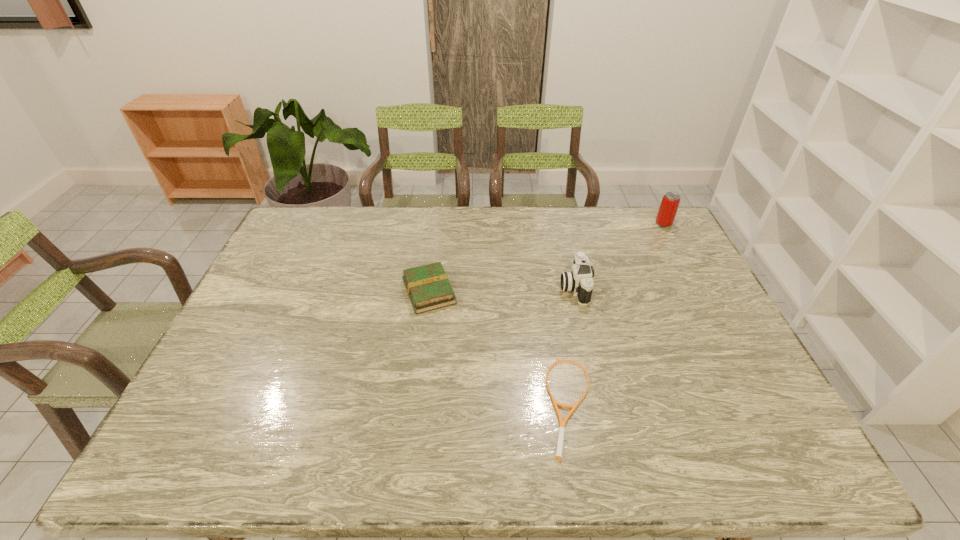
In order to click on the rightmost object in this screenshot , I will do `click(669, 205)`.

The height and width of the screenshot is (540, 960). Identify the location of the farthest object. (669, 205).

This screenshot has height=540, width=960. Identify the location of the second tallest object. [x=579, y=281].

Locate an element on the screen. Image resolution: width=960 pixels, height=540 pixels. the third tallest object is located at coordinates (428, 287).

I want to click on the leftmost object, so click(428, 287).

Identify the location of the nearest object. This screenshot has height=540, width=960. (558, 455).

What are the coordinates of `the shortest object` in the screenshot? It's located at (558, 455).

This screenshot has height=540, width=960. In order to click on vacant space located 0.090m on the front of the beer can in this screenshot , I will do `click(674, 244)`.

This screenshot has width=960, height=540. Identify the location of vacant space located on the left of the third shortest object. (473, 287).

Locate an element on the screen. Image resolution: width=960 pixels, height=540 pixels. vacant space situated on the back of the book is located at coordinates point(436,239).